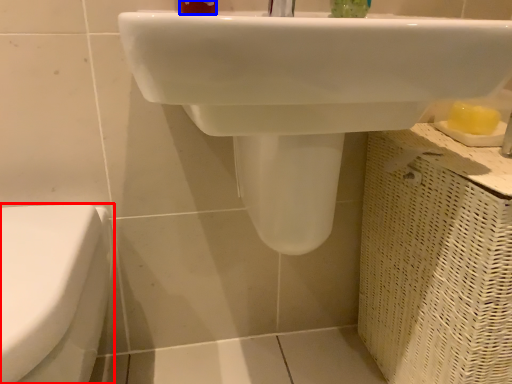
Question: Which of the following is the farthest to the observer, toilet (highlighted by a red box) or toiletry (highlighted by a blue box)?

Choices:
 (A) toilet
 (B) toiletry

Answer: (B)